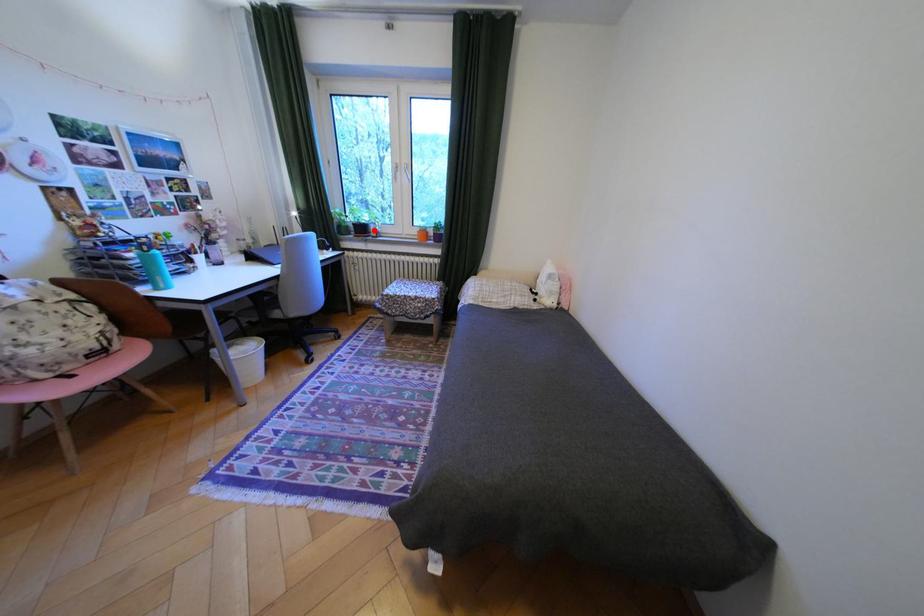
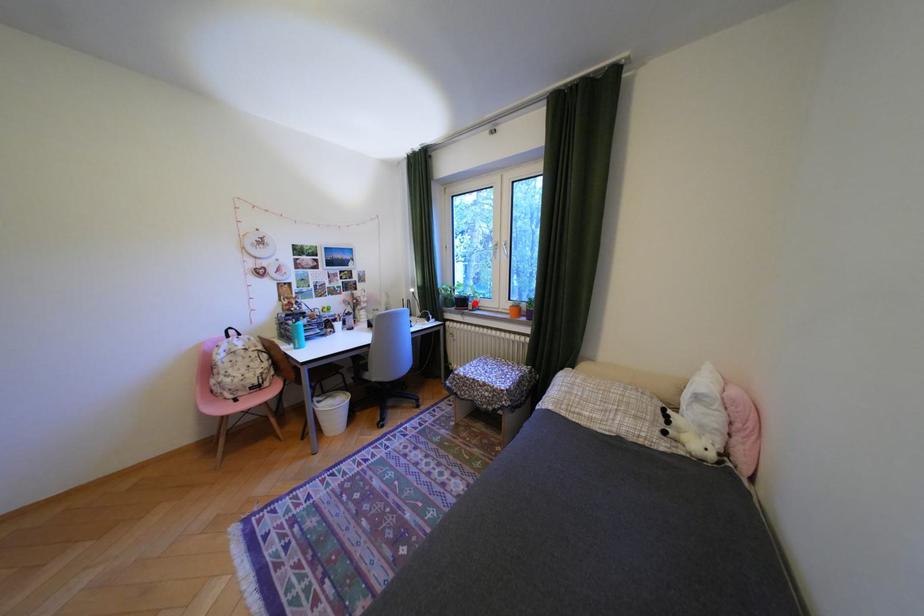
I am providing you with two images of the same scene from different viewpoints. A red point is marked on the first image and another point is marked on the second image. Is the red point in image1 aligned with the point shown in image2?

Yes